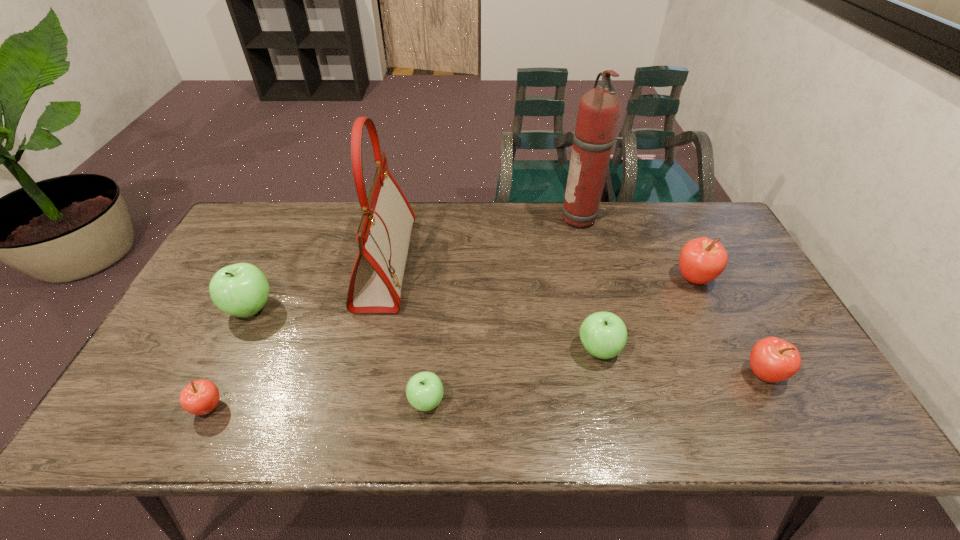
What are the coordinates of `the smallest pink apple` in the screenshot? It's located at (200, 397).

The image size is (960, 540). I want to click on the second green apple from right to left, so click(424, 391).

The width and height of the screenshot is (960, 540). What are the coordinates of `the third apple from left to right` in the screenshot? It's located at (424, 391).

Find the location of a particular element. The image size is (960, 540). blank space located on the side of the red fire extinguisher with the label and nozzle is located at coordinates (447, 219).

At what (x,y) coordinates should I click in order to perform the action: click on free region located 0.150m on the side of the red fire extinguisher with the label and nozzle. Please return your answer as a coordinate pair (x, y). Looking at the image, I should click on (517, 219).

This screenshot has width=960, height=540. In order to click on vacant space located 0.280m on the side of the red fire extinguisher with the label and nozzle in this screenshot , I will do `click(479, 219)`.

The image size is (960, 540). Identify the location of free spot located 0.050m on the front of the handbag. (372, 329).

At what (x,y) coordinates should I click in order to perform the action: click on vacant space located 0.380m on the front of the farthest pink apple. Please return your answer as a coordinate pair (x, y). Image resolution: width=960 pixels, height=540 pixels. Looking at the image, I should click on (761, 417).

This screenshot has height=540, width=960. In order to click on vacant position located on the front of the farthest green apple in this screenshot , I will do `click(224, 363)`.

The width and height of the screenshot is (960, 540). Find the location of `vacant area located 0.110m on the right of the fourth apple from left to right`. vacant area located 0.110m on the right of the fourth apple from left to right is located at coordinates (663, 349).